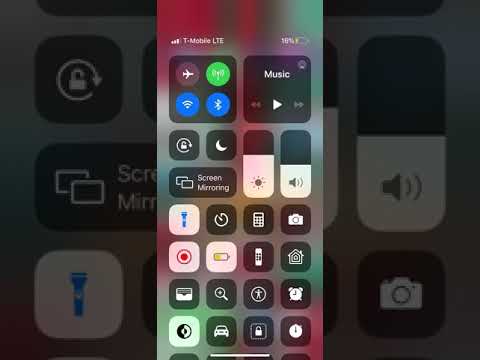
Locate an element on the screen. This screenshot has height=360, width=480. lock is located at coordinates (255, 329).